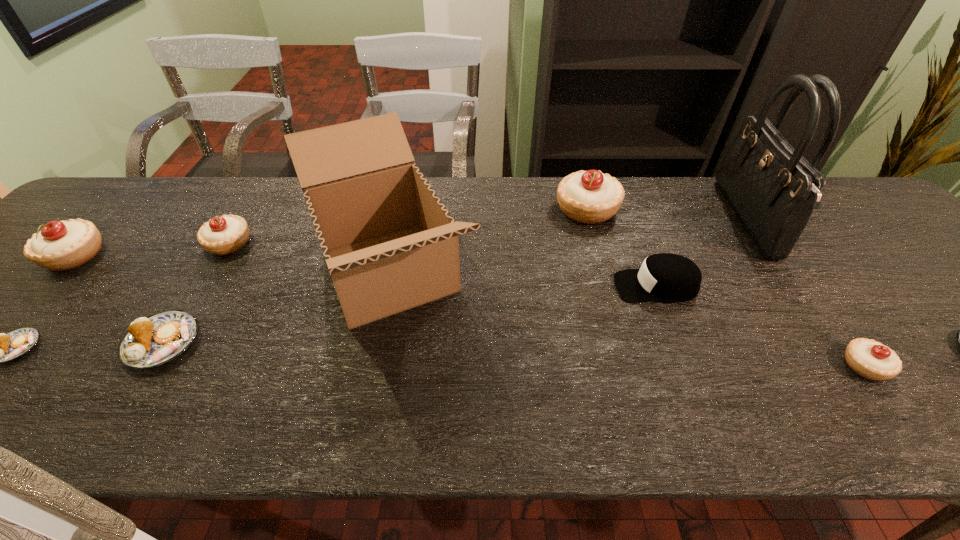
The width and height of the screenshot is (960, 540). What are the coordinates of `black cap` in the screenshot? It's located at (666, 277).

Identify the location of the smallest beige pastry. (870, 359).

Where is `the fourth shortest object`? the fourth shortest object is located at coordinates (870, 359).

The image size is (960, 540). I want to click on the second brown pastry from left to right, so click(x=150, y=342).

I want to click on the fifth tallest pastry, so click(150, 342).

Locate an element on the screen. vacant space located with an open clasp on the front of the handbag is located at coordinates (697, 220).

Find the location of a particular element. This screenshot has height=540, width=960. free space located with an open clasp on the front of the handbag is located at coordinates (661, 220).

I want to click on free region located 0.210m with an open clasp on the front of the handbag, so click(x=658, y=220).

Find the location of `vacant point located on the left of the second tallest object`. vacant point located on the left of the second tallest object is located at coordinates (237, 272).

What are the coordinates of `blank space located 0.290m on the front of the biggest beige pastry` in the screenshot? It's located at (614, 313).